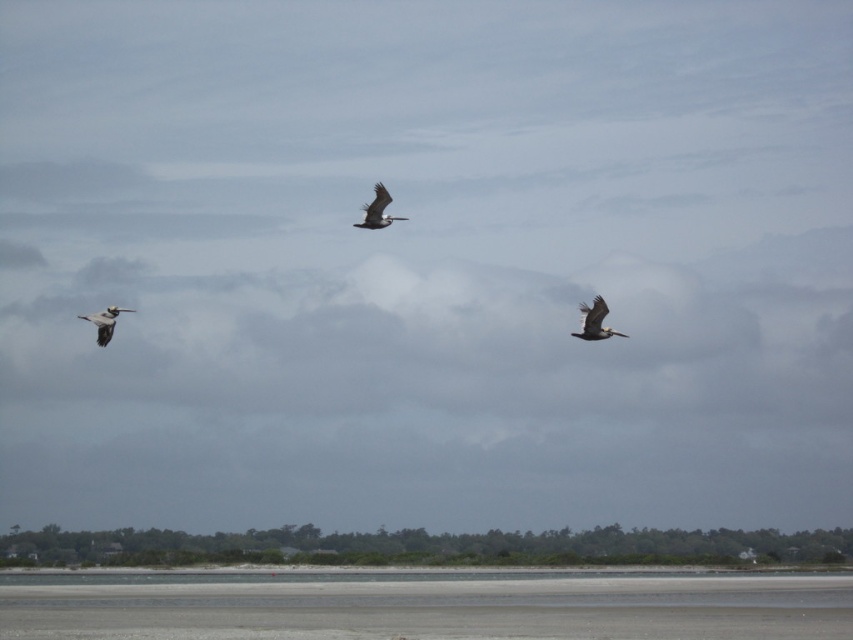
You are standing at the point closer to the viewer in the image. Which point are you at, point (584, 317) or point (103, 314)?

You are at point (584, 317) because it is further to the viewer than point (103, 314).